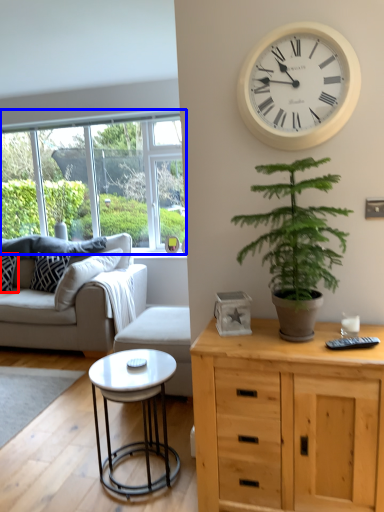
Question: Which object appears closest to the camera in this image, pillow (highlighted by a red box) or window (highlighted by a blue box)?

Choices:
 (A) pillow
 (B) window

Answer: (A)